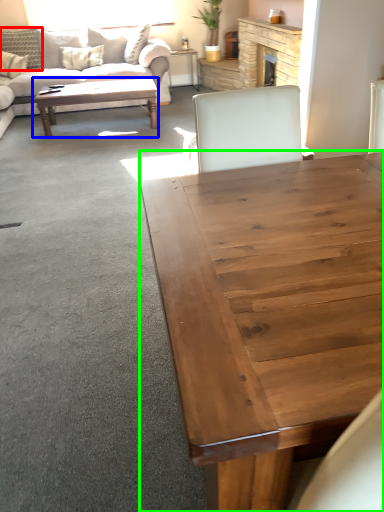
Question: Based on their relative distances, which object is nearer to pillow (highlighted by a red box)? Choose from coffee table (highlighted by a blue box) and coffee table (highlighted by a green box).

Choices:
 (A) coffee table
 (B) coffee table

Answer: (A)